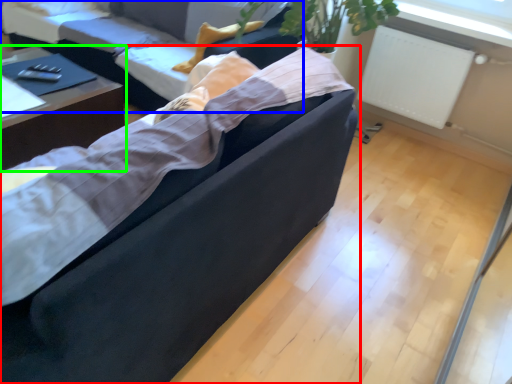
Question: Which object is the farthest from studio couch (highlighted by a red box)? Choose among these: studio couch (highlighted by a blue box) or table (highlighted by a green box).

Choices:
 (A) studio couch
 (B) table

Answer: (A)